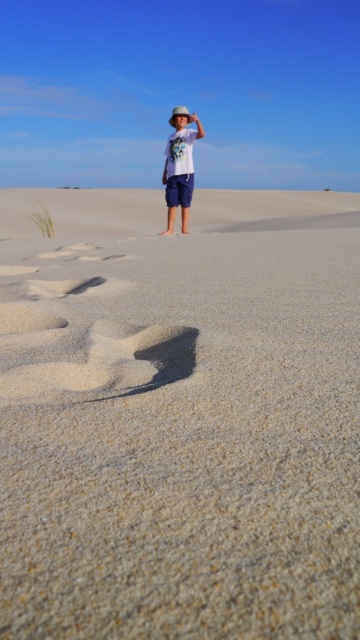
Does fine-grained sand at center appear under brown sandy footprint at lower left?

Incorrect, fine-grained sand at center is not positioned below brown sandy footprint at lower left.

Does point (149, 253) lie behind point (97, 284)?

Yes, it is.

At what (x,y) coordinates should I click in order to perform the action: click on fine-grained sand at center. Please return your answer as a coordinate pair (x, y). Looking at the image, I should click on coord(180,417).

Is white cotton shirt at center taller than brown sandy footprint at lower left?

Correct, white cotton shirt at center is much taller as brown sandy footprint at lower left.

Who is higher up, white cotton shirt at center or brown sandy footprint at lower left?

white cotton shirt at center

Between point (180, 177) and point (72, 288), which one is positioned in front?

Point (72, 288)

Locate an element on the screen. white cotton shirt at center is located at coordinates (180, 164).

Is fine-grained sand at center above white cotton shirt at center?

Correct, fine-grained sand at center is located above white cotton shirt at center.

Consider the image. Is fine-grained sand at center taller than white cotton shirt at center?

Correct, fine-grained sand at center is much taller as white cotton shirt at center.

Is point (345, 204) positioned after point (168, 209)?

Yes.

Where is `fine-grained sand at center`? fine-grained sand at center is located at coordinates (180, 417).